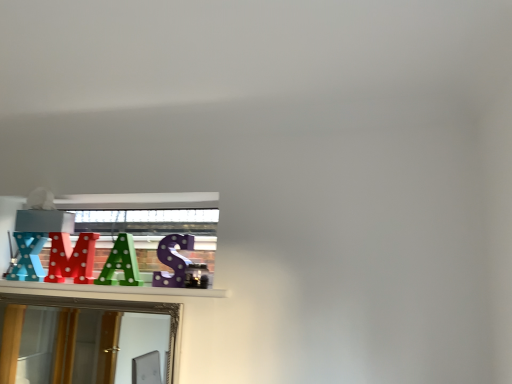
Question: Is gold-framed mirror at lower left to the left or to the right of green polka dot letter at center in the image?

Choices:
 (A) right
 (B) left

Answer: (B)

Question: In the image, is gold-framed mirror at lower left positioned in front of or behind green polka dot letter at center?

Choices:
 (A) behind
 (B) front

Answer: (B)

Question: Is gold-framed mirror at lower left bigger or smaller than green polka dot letter at center?

Choices:
 (A) big
 (B) small

Answer: (A)

Question: In the image, is green polka dot letter at center positioned in front of or behind gold-framed mirror at lower left?

Choices:
 (A) front
 (B) behind

Answer: (B)

Question: Considering the relative positions of green polka dot letter at center and gold-framed mirror at lower left in the image provided, is green polka dot letter at center to the left or to the right of gold-framed mirror at lower left?

Choices:
 (A) right
 (B) left

Answer: (A)

Question: Is point (129, 284) positioned closer to the camera than point (135, 350)?

Choices:
 (A) closer
 (B) farther

Answer: (A)

Question: From the image's perspective, relative to gold-framed mirror at lower left, is green polka dot letter at center above or below?

Choices:
 (A) below
 (B) above

Answer: (B)